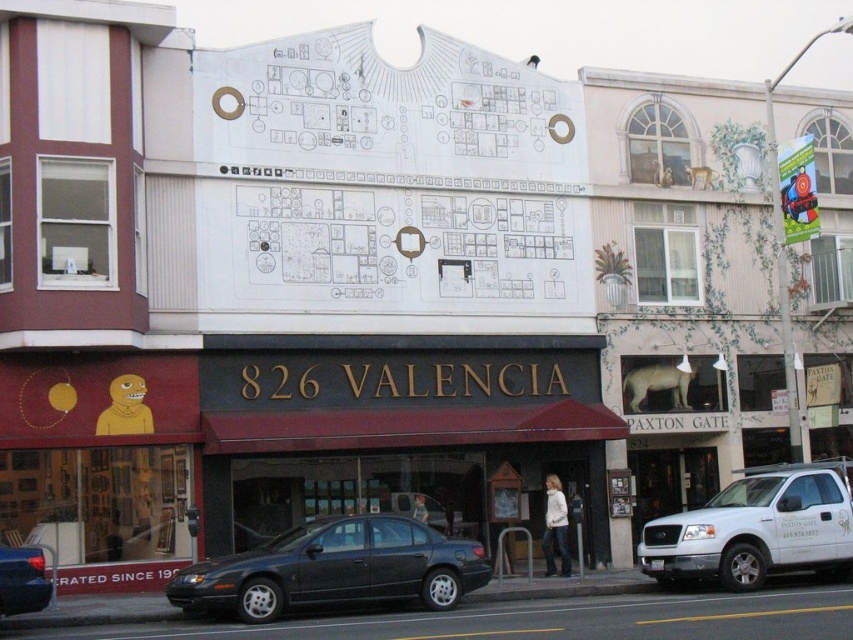
From the picture: Does matte black sedan at center appear on the left side of matte black sedan at lower left?

No, matte black sedan at center is not to the left of matte black sedan at lower left.

What are the coordinates of `matte black sedan at center` in the screenshot? It's located at (334, 568).

Who is more forward, (341, 582) or (28, 564)?

Point (28, 564)

Find the location of a particular element. The height and width of the screenshot is (640, 853). matte black sedan at center is located at coordinates (334, 568).

Can you confirm if white matte truck at lower right is shorter than matte black sedan at lower left?

No, white matte truck at lower right is not shorter than matte black sedan at lower left.

Which is more to the left, white matte truck at lower right or matte black sedan at lower left?

matte black sedan at lower left

Where is `white matte truck at lower right`? This screenshot has width=853, height=640. white matte truck at lower right is located at coordinates (757, 529).

Which is in front, point (482, 561) or point (815, 552)?

Positioned in front is point (482, 561).

Between matte black sedan at center and white matte truck at lower right, which one appears on the left side from the viewer's perspective?

Positioned to the left is matte black sedan at center.

Which is behind, point (399, 595) or point (704, 522)?

Positioned behind is point (704, 522).

Where is `matte black sedan at center`? This screenshot has height=640, width=853. matte black sedan at center is located at coordinates (334, 568).